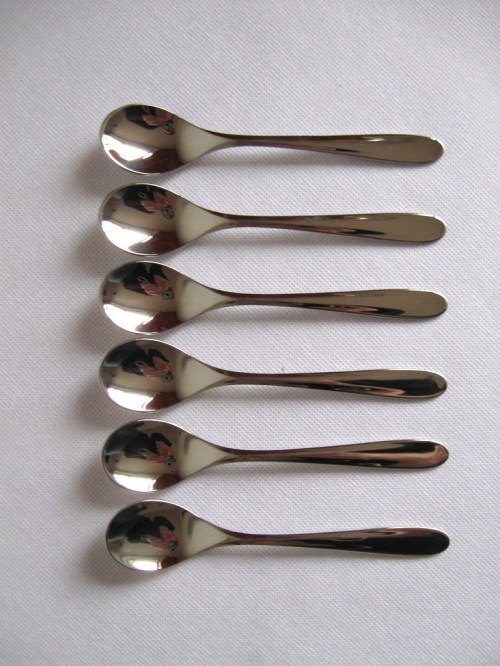
Where is `silver spoons`? silver spoons is located at coordinates (161, 135), (165, 226), (169, 308), (158, 376), (158, 463), (163, 551).